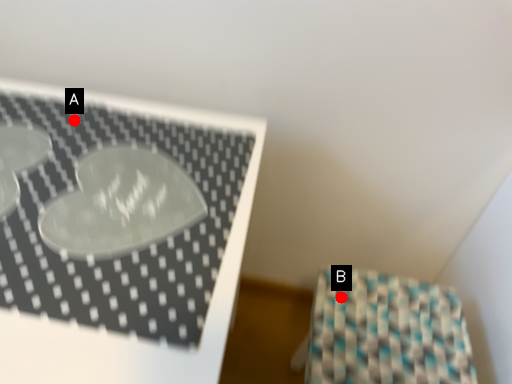
Question: Two points are circled on the image, labeled by A and B beside each circle. Which point is closer to the camera taking this photo?

Choices:
 (A) A is closer
 (B) B is closer

Answer: (A)